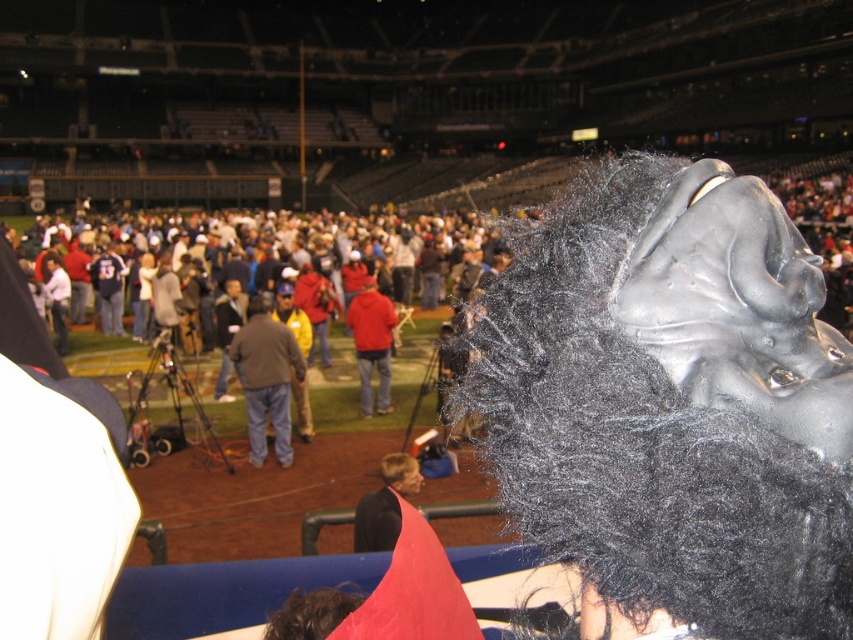
Question: Among these objects, which one is nearest to the camera?

Choices:
 (A) smooth skin face at center
 (B) dark brown leather jacket at center

Answer: (A)

Question: Which object appears farthest from the camera in this image?

Choices:
 (A) smooth skin face at center
 (B) gray fabric jacket at center

Answer: (B)

Question: Does shiny metallic gorilla head at upper right appear over matte red jacket at center?

Choices:
 (A) no
 (B) yes

Answer: (A)

Question: Among these objects, which one is nearest to the camera?

Choices:
 (A) smooth skin face at center
 (B) matte red jacket at center

Answer: (A)

Question: Is gray fabric jacket at center to the right of matte red jacket at center from the viewer's perspective?

Choices:
 (A) yes
 (B) no

Answer: (B)

Question: Where is brown leather jacket at center located in relation to red matte jacket at center in the image?

Choices:
 (A) above
 (B) below

Answer: (B)